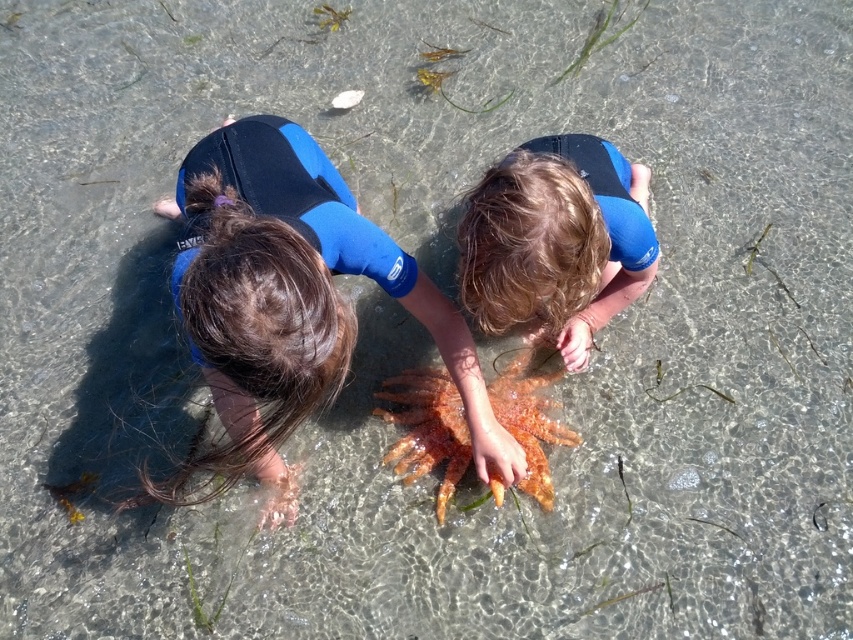
You are a drone operator trying to capture a photo of two children exploring a starfish in the water. The children are located at point [312,304] and point [570,436]. To ensure both children are in frame, you need to position the drone so that the camera faces towards the point that is further away from you. Which point should the drone face towards?

The drone should face towards point [570,436] because point [312,304] is in front of point [570,436], meaning the latter is further away from the drone operator.

You are a photographer standing at point point (637, 282). You want to take a photo of the children exploring the starfish. The camera you are using has a maximum focusing distance of 2 meters. Will you be able to capture a clear photo of the children?

The distance between point (637, 282) and the camera is 1.87 meters, which is within the camera maximum focusing distance of 2 meters. Therefore, you can capture a clear photo of the children.